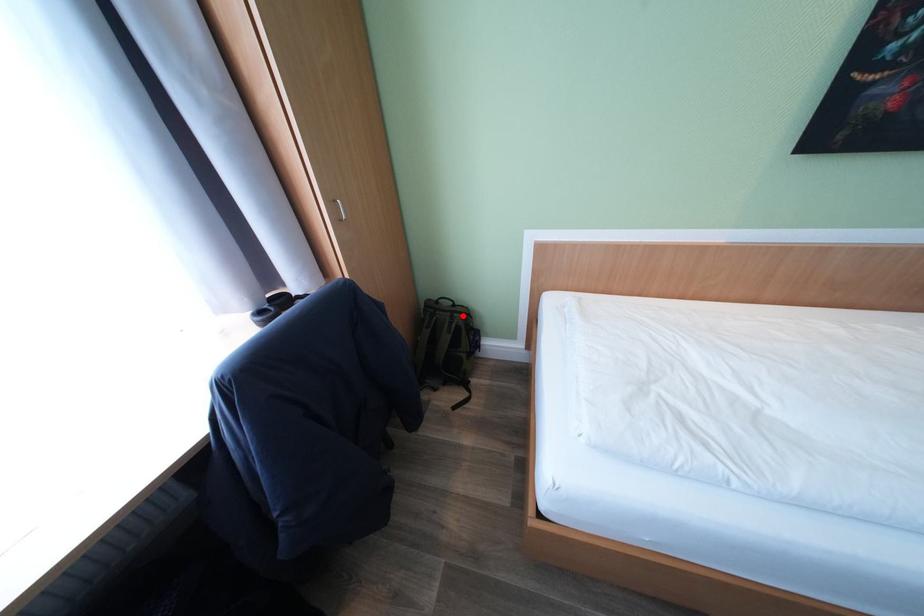
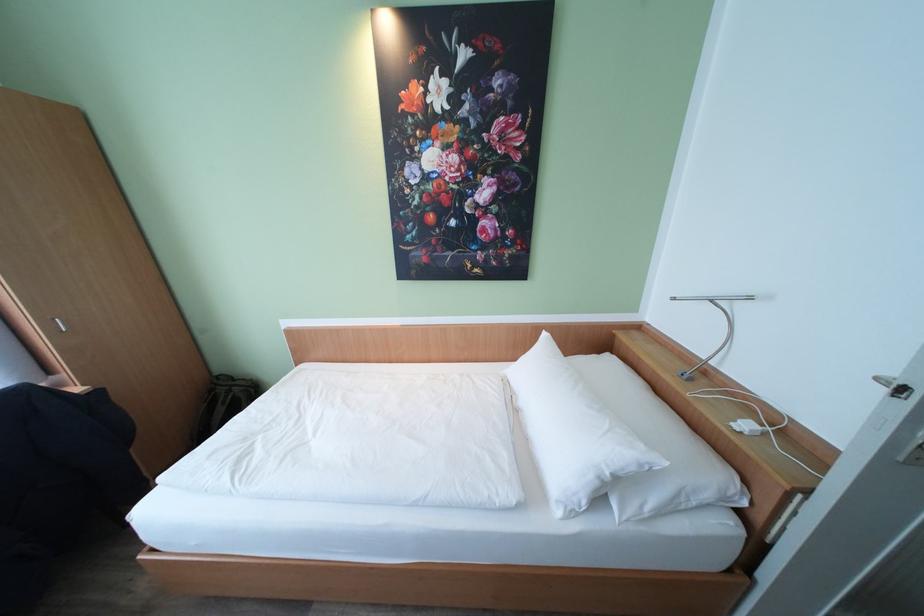
Question: A red point is marked in image1. In image2, is the corresponding 3D point closer to the camera or farther? Reply with the corresponding letter.

Choices:
 (A) The corresponding 3D point is closer.
 (B) The corresponding 3D point is farther.

Answer: (B)